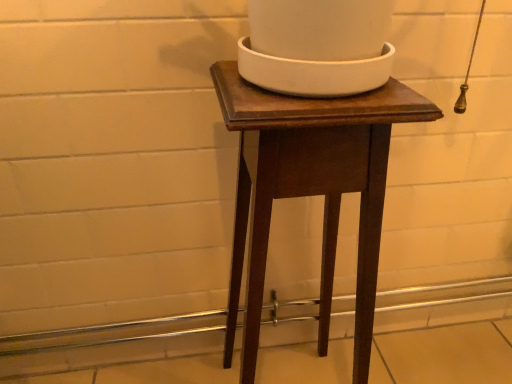
This screenshot has height=384, width=512. In order to click on matte dark wood stool at center in this screenshot , I will do `click(310, 189)`.

Measure the distance between matte dark wood stool at center and camera.

The depth of matte dark wood stool at center is 40.98 centimeters.

This screenshot has width=512, height=384. What do you see at coordinates (310, 189) in the screenshot?
I see `matte dark wood stool at center` at bounding box center [310, 189].

Locate an element on the screen. The width and height of the screenshot is (512, 384). matte dark wood stool at center is located at coordinates (310, 189).